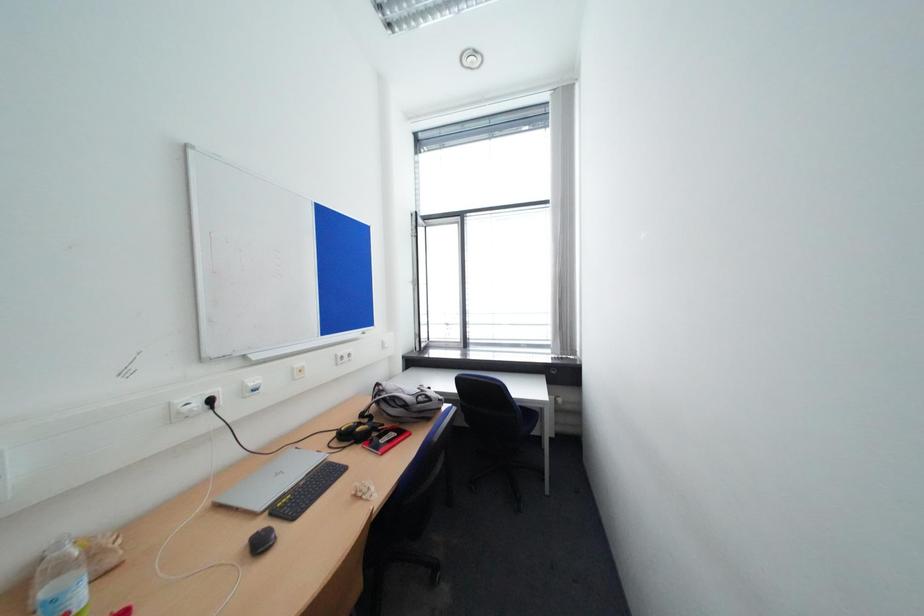
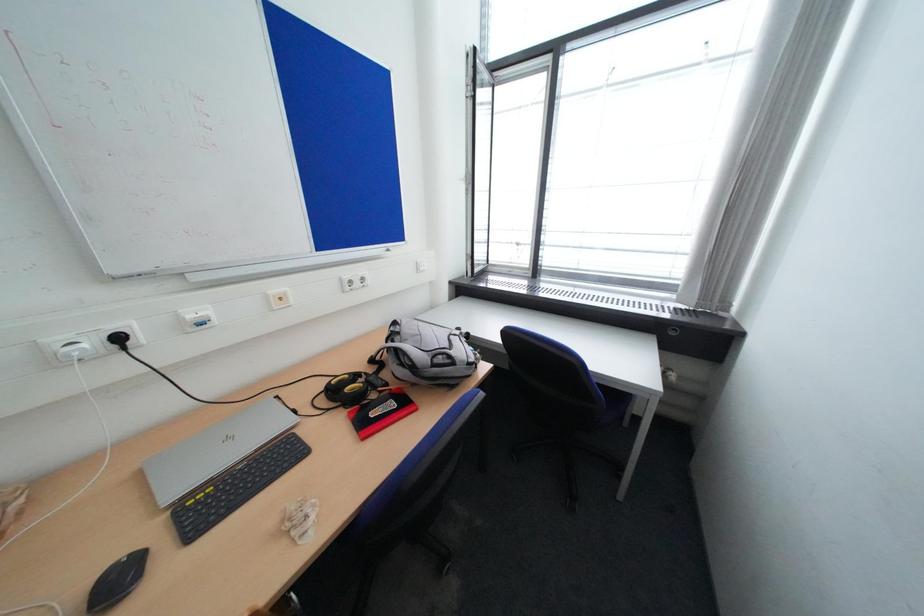
Based on the photo, first-person continuous shooting, in which direction is the camera rotating?

The camera rotated toward left-down.